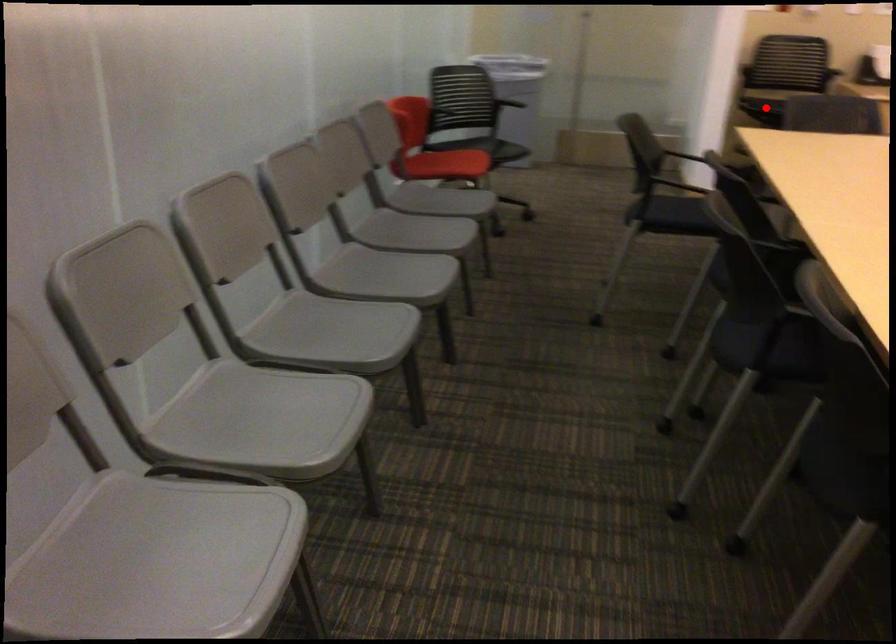
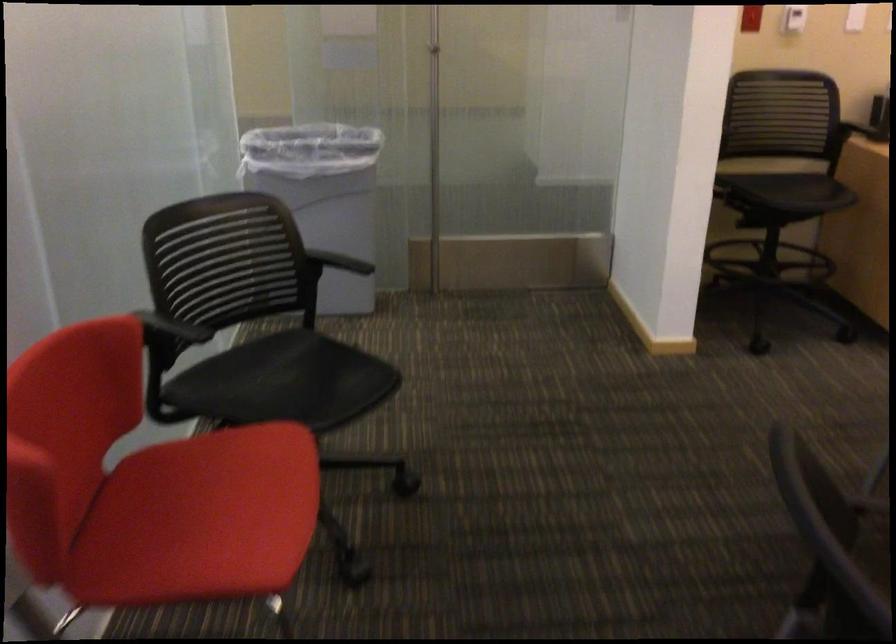
Where in the second image is the point corresponding to the highlighted location from the first image?

(721, 202)